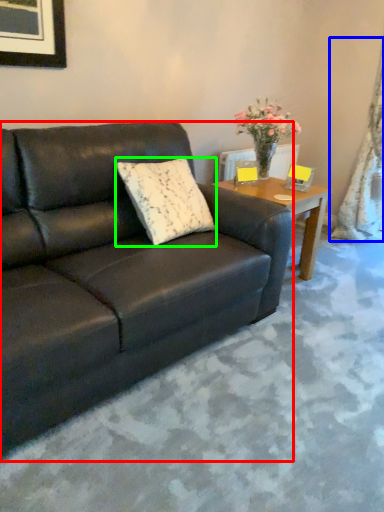
Question: Which object is the closest to the studio couch (highlighted by a red box)? Choose among these: curtain (highlighted by a blue box) or pillow (highlighted by a green box).

Choices:
 (A) curtain
 (B) pillow

Answer: (B)